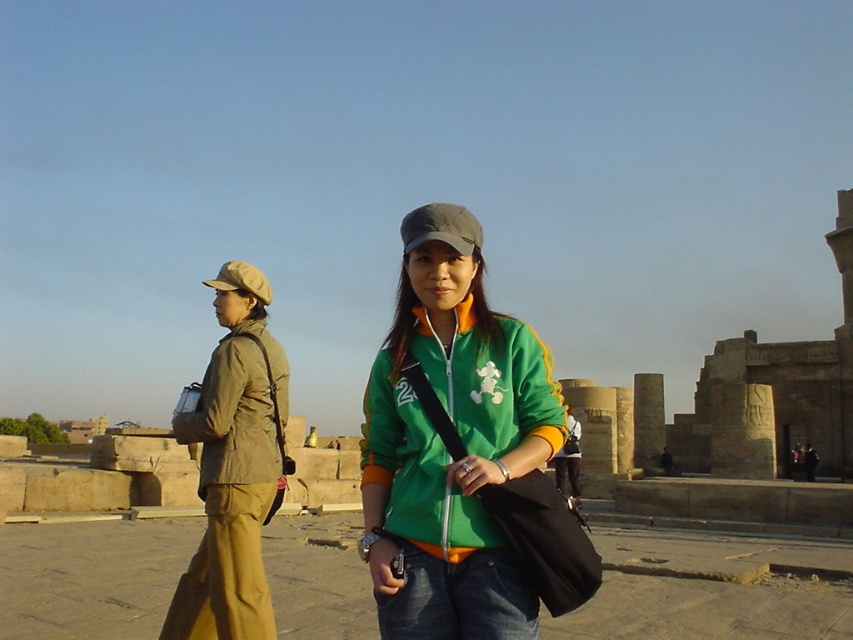
Can you confirm if green fabric baseball cap at center is wider than tan fabric baseball cap at left?

Incorrect, green fabric baseball cap at center's width does not surpass tan fabric baseball cap at left's.

Does green fabric baseball cap at center appear on the right side of tan fabric baseball cap at left?

Correct, you'll find green fabric baseball cap at center to the right of tan fabric baseball cap at left.

Identify the location of green fabric baseball cap at center. (440, 227).

Is green matte jacket at center to the left of tan fabric jacket at left from the viewer's perspective?

Incorrect, green matte jacket at center is not on the left side of tan fabric jacket at left.

Who is more distant from viewer, [405,225] or [287,403]?

The point [287,403] is more distant.

Who is more forward, [459,534] or [216,518]?

Point [459,534] is more forward.

Identify the location of green matte jacket at center. The image size is (853, 640). (444, 444).

Is point (206, 394) farther from viewer compared to point (259, 284)?

No, (206, 394) is in front of (259, 284).

Looking at this image, is khaki fabric jacket at left positioned before tan fabric baseball cap at left?

Yes.

Identify the location of khaki fabric jacket at left. (238, 410).